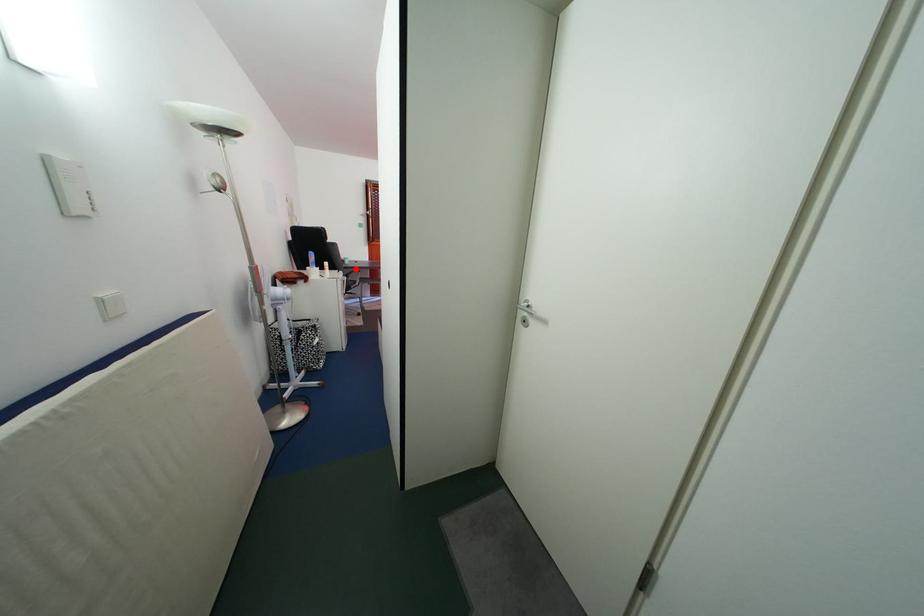
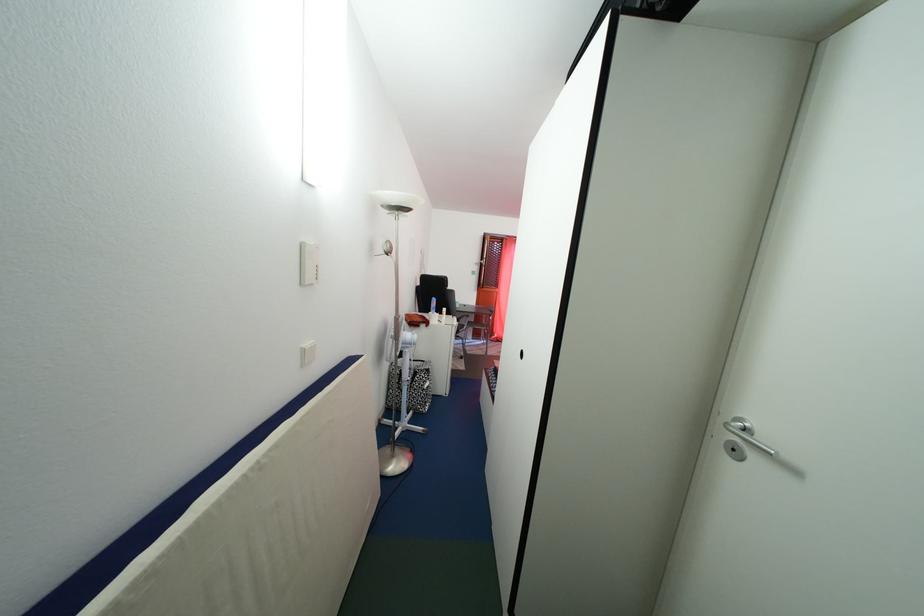
Find the pixel in the second image that matches the highlighted location in the first image.

(466, 313)